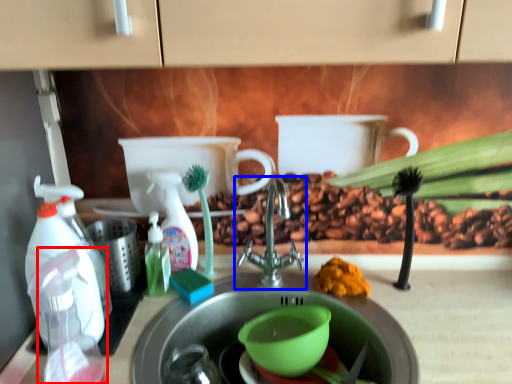
Question: Which point is further to the camera, bottle (highlighted by a red box) or tap (highlighted by a blue box)?

Choices:
 (A) bottle
 (B) tap

Answer: (B)